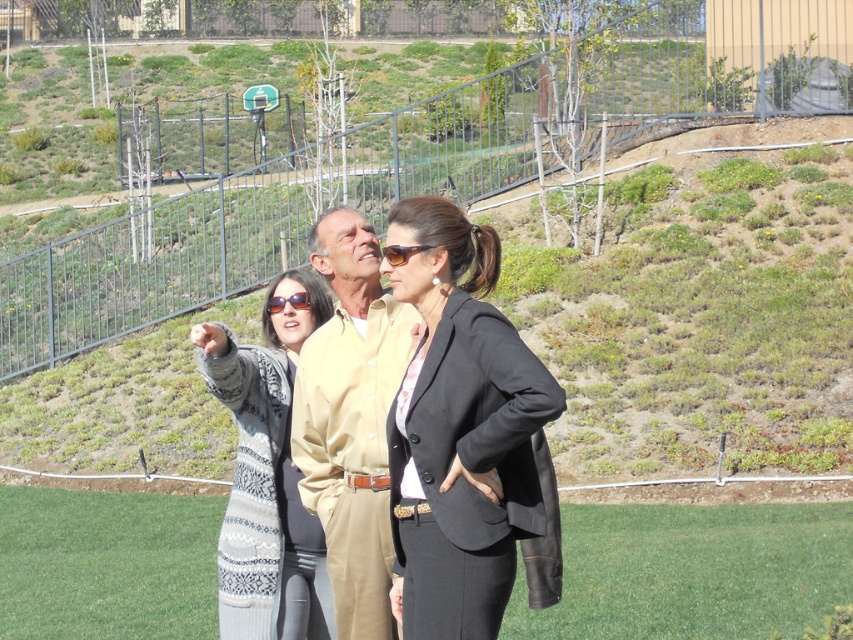
Question: Which of the following is the farthest from the observer?

Choices:
 (A) matte black sunglasses at center
 (B) green grass at center
 (C) black matte blazer at center
 (D) knitted gray sweater at center

Answer: (B)

Question: Which object is the closest to the matte brown sunglasses at center?

Choices:
 (A) black matte blazer at center
 (B) tan cotton shirt at center

Answer: (A)

Question: Among these objects, which one is farthest from the camera?

Choices:
 (A) green grass at center
 (B) matte black sunglasses at center
 (C) matte brown sunglasses at center

Answer: (A)

Question: Is tan cotton shirt at center thinner than matte brown sunglasses at center?

Choices:
 (A) yes
 (B) no

Answer: (B)

Question: Is tan cotton shirt at center below matte brown sunglasses at center?

Choices:
 (A) no
 (B) yes

Answer: (B)

Question: Is black matte blazer at center positioned at the back of tan cotton shirt at center?

Choices:
 (A) yes
 (B) no

Answer: (B)